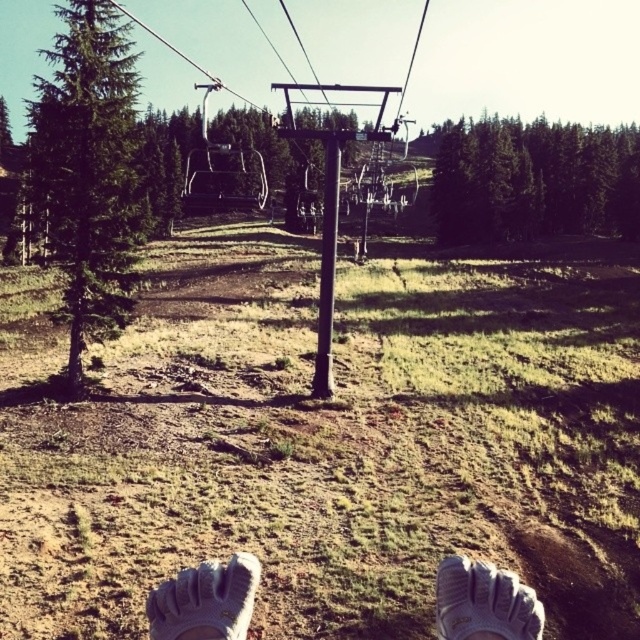
Consider the image. How much distance is there between green textured pine tree at left and white textured shoes at lower center?

They are 55.69 meters apart.

Identify the location of green textured pine tree at left. (88, 170).

Is point (560, 129) positioned after point (445, 608)?

Yes, it is behind point (445, 608).

At what (x,y) coordinates should I click in order to perform the action: click on green matte tree at upper center. Please return your answer as a coordinate pair (x, y). This screenshot has width=640, height=640. Looking at the image, I should click on (532, 179).

The width and height of the screenshot is (640, 640). What do you see at coordinates (532, 179) in the screenshot?
I see `green matte tree at upper center` at bounding box center [532, 179].

This screenshot has height=640, width=640. Identify the location of green matte tree at upper center. (532, 179).

Between white textured shoes at lower center and white textured shoe at lower center, which one appears on the left side from the viewer's perspective?

Positioned to the left is white textured shoe at lower center.

This screenshot has width=640, height=640. What do you see at coordinates (205, 600) in the screenshot? I see `white textured shoes at lower center` at bounding box center [205, 600].

Which is behind, point (240, 632) or point (237, 611)?

Positioned behind is point (237, 611).

Locate an element on the screen. The image size is (640, 640). white textured shoes at lower center is located at coordinates (205, 600).